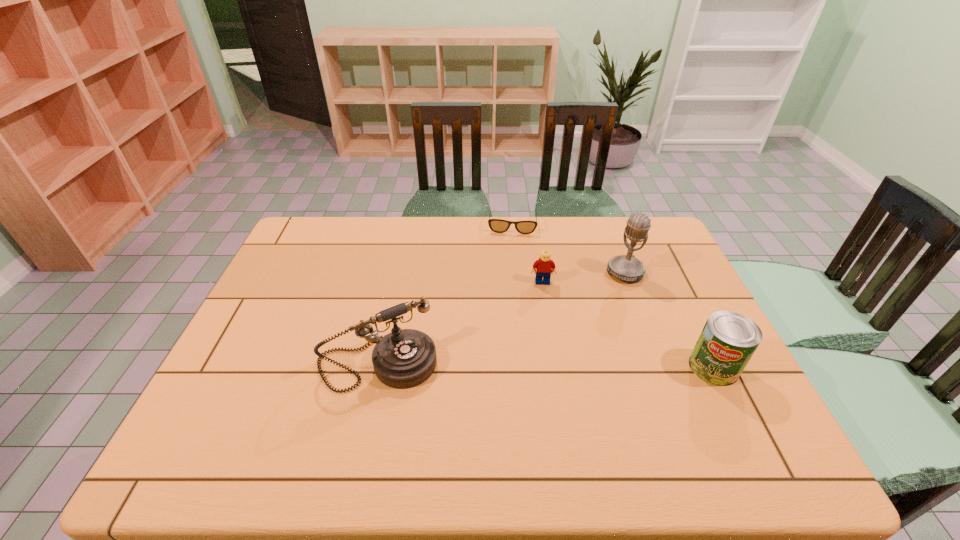
At what (x,y) coordinates should I click in order to perform the action: click on can located at the right edge. Please return your answer as a coordinate pair (x, y). Looking at the image, I should click on coord(728,340).

You are a GUI agent. You are given a task and a screenshot of the screen. Output one action in this format:
    pyautogui.click(x=<x>, y=<y>)
    Task: Click on the microphone that is at the right edge
    
    Given the screenshot: What is the action you would take?
    pyautogui.click(x=628, y=268)

The height and width of the screenshot is (540, 960). What are the coordinates of `vacant region at the far edge of the desktop` in the screenshot? It's located at (519, 219).

At what (x,y) coordinates should I click in order to perform the action: click on vacant space at the near edge of the desktop. Please return your answer as a coordinate pair (x, y). This screenshot has width=960, height=540. Looking at the image, I should click on (315, 427).

I want to click on vacant area at the left edge, so click(x=264, y=351).

Find the location of `free location at the right edge of the desktop`. free location at the right edge of the desktop is located at coordinates (672, 258).

The width and height of the screenshot is (960, 540). I want to click on free space at the far left corner of the desktop, so click(x=327, y=257).

Where is `free spot at the far right corner of the desktop`? free spot at the far right corner of the desktop is located at coordinates (612, 218).

Where is `free space between the telephone and the fourth tallest object`? The height and width of the screenshot is (540, 960). free space between the telephone and the fourth tallest object is located at coordinates (460, 323).

Where is `unoccupied area between the can and the fourth tallest object`? The height and width of the screenshot is (540, 960). unoccupied area between the can and the fourth tallest object is located at coordinates (628, 325).